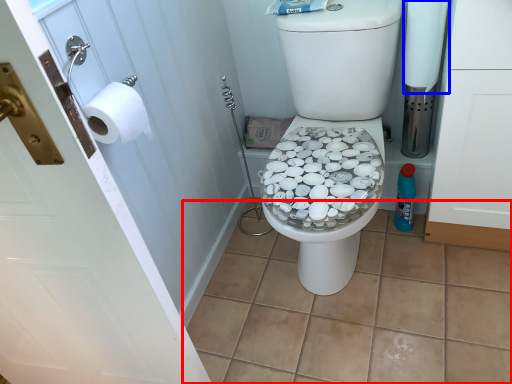
Question: Which object is closer to the camera taking this photo, tile (highlighted by a red box) or toilet paper (highlighted by a blue box)?

Choices:
 (A) tile
 (B) toilet paper

Answer: (A)